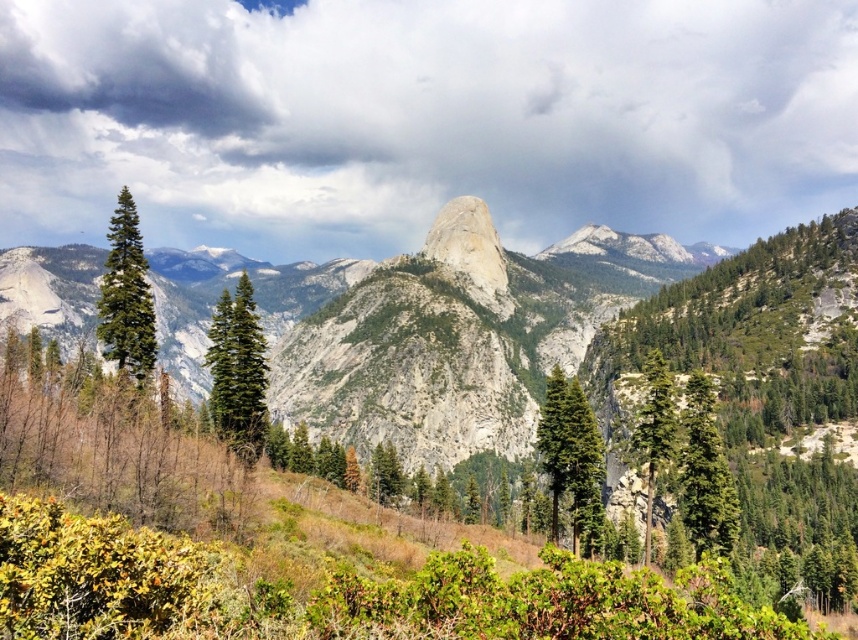
Can you confirm if green matte tree at center is positioned to the right of green matte tree at center-right?

In fact, green matte tree at center is to the left of green matte tree at center-right.

Does point (547, 465) come in front of point (699, 483)?

No, it is behind (699, 483).

Identify the location of green matte tree at center. (571, 456).

Which is more to the right, rocky gray mountain at center or green matte tree at center-left?

rocky gray mountain at center

Can you confirm if rocky gray mountain at center is positioned above green matte tree at center-left?

Correct, rocky gray mountain at center is located above green matte tree at center-left.

Where is `rocky gray mountain at center`? rocky gray mountain at center is located at coordinates tap(533, 332).

Identify the location of rocky gray mountain at center. (533, 332).

Who is more distant from viewer, (x=118, y=324) or (x=672, y=397)?

Positioned behind is point (x=118, y=324).

Identify the location of green matte tree at left. (125, 296).

At what (x,y) coordinates should I click in order to perform the action: click on green matte tree at left. Please return your answer as a coordinate pair (x, y). The height and width of the screenshot is (640, 858). Looking at the image, I should click on (125, 296).